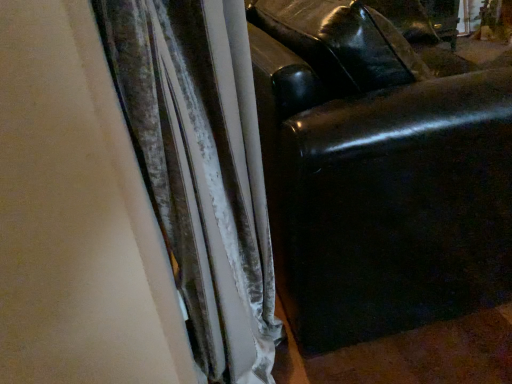
Where is `black leather couch at right`? Image resolution: width=512 pixels, height=384 pixels. black leather couch at right is located at coordinates [x=377, y=174].

What do you see at coordinates (377, 174) in the screenshot? I see `black leather couch at right` at bounding box center [377, 174].

Measure the distance between velvet curtain at center and camera.

The depth of velvet curtain at center is 51.28 centimeters.

What do you see at coordinates (201, 169) in the screenshot? I see `velvet curtain at center` at bounding box center [201, 169].

In the scene shown: In order to face velvet curtain at center, should I rotate leftwards or rightwards?

To face it directly, rotate right by 0.571 degrees.

What is the approximate height of velvet curtain at center?

37.07 inches.

Where is `velvet curtain at center`? This screenshot has width=512, height=384. velvet curtain at center is located at coordinates (201, 169).

At what (x,y) coordinates should I click in order to perform the action: click on black leather couch at right. Please return your answer as a coordinate pair (x, y). Image resolution: width=512 pixels, height=384 pixels. Looking at the image, I should click on (377, 174).

Which is more to the left, velvet curtain at center or black leather couch at right?

velvet curtain at center.

Is velvet curtain at center further to camera compared to black leather couch at right?

No.

Is point (255, 113) closer to camera compared to point (456, 267)?

Yes, it is.

In the scene shown: From the image's perspective, between velvet curtain at center and black leather couch at right, which one is located above?

From the image's view, black leather couch at right is above.

From a real-world perspective, relative to black leather couch at right, is velvet curtain at center vertically above or below?

velvet curtain at center is above black leather couch at right.

Which of these two, velvet curtain at center or black leather couch at right, is wider?

black leather couch at right is wider.

Which of these two, velvet curtain at center or black leather couch at right, stands shorter?

black leather couch at right.

Consider the image. Based on their sizes in the image, would you say velvet curtain at center is bigger or smaller than black leather couch at right?

Considering their sizes, velvet curtain at center takes up less space than black leather couch at right.

Is black leather couch at right a part of velvet curtain at center?

That's incorrect, black leather couch at right is not inside velvet curtain at center.

Can you see velvet curtain at center touching black leather couch at right?

velvet curtain at center and black leather couch at right are not in contact.

Is velvet curtain at center positioned with its back to black leather couch at right?

That's not correct — velvet curtain at center is not looking away from black leather couch at right.

Based on the photo, what's the angular difference between velvet curtain at center and black leather couch at right's facing directions?

The angular difference between velvet curtain at center and black leather couch at right is 0.585 degrees.

How distant is velvet curtain at center from black leather couch at right?

A distance of 9.53 inches exists between velvet curtain at center and black leather couch at right.

The image size is (512, 384). I want to click on furniture to the right of velvet curtain at center, so click(377, 174).

Visually, is black leather couch at right positioned to the left or to the right of velvet curtain at center?

From the image, it's evident that black leather couch at right is to the right of velvet curtain at center.

Consider the image. Which object is more forward, black leather couch at right or velvet curtain at center?

velvet curtain at center is more forward.

Considering the positions of point (446, 267) and point (202, 280), is point (446, 267) closer or farther from the camera than point (202, 280)?

Point (446, 267) is positioned farther from the camera compared to point (202, 280).

From the image's perspective, is black leather couch at right located above or below velvet curtain at center?

black leather couch at right is situated higher than velvet curtain at center in the image.

In the scene shown: From a real-world perspective, is black leather couch at right positioned over velvet curtain at center based on gravity?

No, from a real-world perspective, black leather couch at right is not over velvet curtain at center

In the scene shown: Between black leather couch at right and velvet curtain at center, which one has larger width?

black leather couch at right.

Considering the relative sizes of black leather couch at right and velvet curtain at center in the image provided, is black leather couch at right taller than velvet curtain at center?

No.

Is black leather couch at right smaller than velvet curtain at center?

No, black leather couch at right is not smaller than velvet curtain at center.

Is black leather couch at right completely or partially outside of velvet curtain at center?

Yes.

Are black leather couch at right and velvet curtain at center far apart?

No, there isn't a large distance between black leather couch at right and velvet curtain at center.

Could you tell me if black leather couch at right is facing velvet curtain at center?

No, black leather couch at right is not aimed at velvet curtain at center.

The width and height of the screenshot is (512, 384). Identify the location of furniture on the right of velvet curtain at center. (377, 174).

Where is `curtain lying below the black leather couch at right (from the image's perspective)`? Image resolution: width=512 pixels, height=384 pixels. curtain lying below the black leather couch at right (from the image's perspective) is located at coordinates (201, 169).

You are a GUI agent. You are given a task and a screenshot of the screen. Output one action in this format:
    pyautogui.click(x=<x>, y=<y>)
    Task: Click on the furniture below the velvet curtain at center (from a real-world perspective)
    Image resolution: width=512 pixels, height=384 pixels.
    Given the screenshot: What is the action you would take?
    (x=377, y=174)